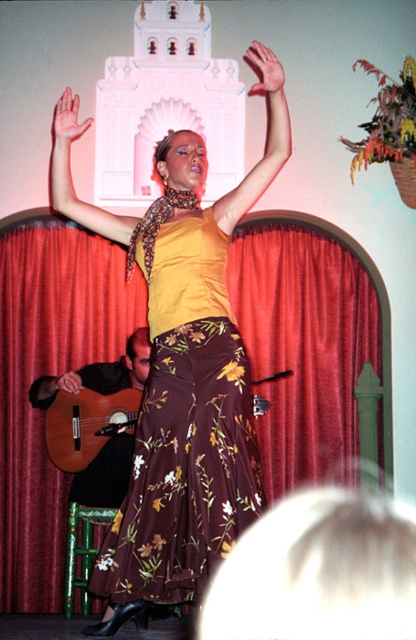
Question: Which of the following is the farthest from the observer?

Choices:
 (A) (x=54, y=122)
 (B) (x=230, y=506)
 (C) (x=12, y=420)
 (D) (x=225, y=205)

Answer: (C)

Question: Does red velvet curtain at center have a larger size compared to light skin smooth hand at upper center?

Choices:
 (A) no
 (B) yes

Answer: (B)

Question: Does floral-patterned fabric at center have a smaller size compared to smooth skin hand at upper center?

Choices:
 (A) yes
 (B) no

Answer: (A)

Question: Which of the following is the farthest from the observer?

Choices:
 (A) matte yellow fabric at upper center
 (B) brown floral skirt at center

Answer: (A)

Question: Can you confirm if floral-patterned fabric at center is positioned below smooth skin hand at upper center?

Choices:
 (A) no
 (B) yes

Answer: (B)

Question: Among these points, which one is nearest to the camera?

Choices:
 (A) click(56, 387)
 (B) click(86, 120)
 (C) click(200, 301)

Answer: (C)